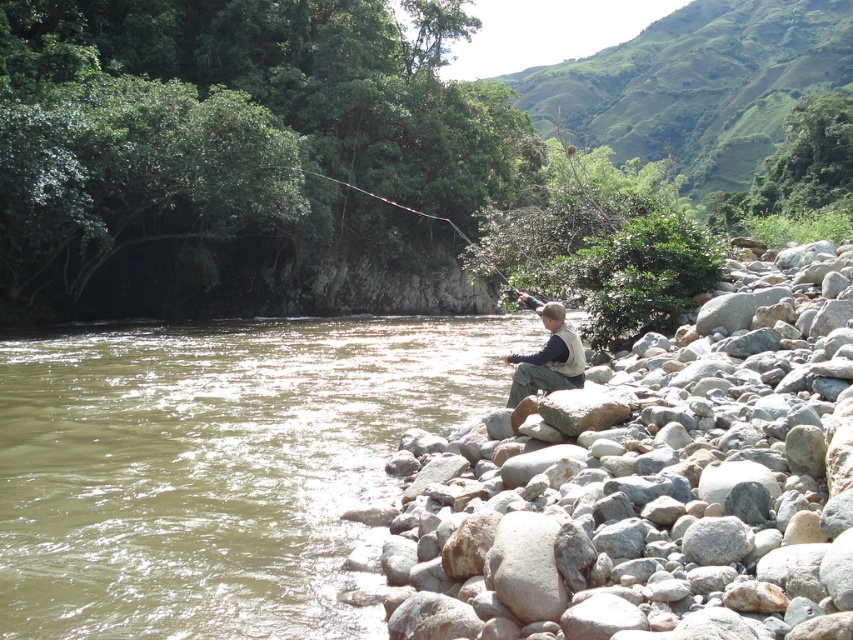
Is greenish water at lower left to the left of smooth brown fishing rod at upper center from the viewer's perspective?

No, greenish water at lower left is not to the left of smooth brown fishing rod at upper center.

Between greenish water at lower left and smooth brown fishing rod at upper center, which one has less height?

greenish water at lower left

Between point (172, 481) and point (492, 268), which one is positioned behind?

The point (492, 268) is behind.

The width and height of the screenshot is (853, 640). I want to click on greenish water at lower left, so (215, 467).

From the picture: Between gray smooth rock at right and greenish water at lower left, which one appears on the left side from the viewer's perspective?

greenish water at lower left

The height and width of the screenshot is (640, 853). What are the coordinates of `gray smooth rock at right` in the screenshot? It's located at (645, 493).

Can you confirm if gray smooth rock at right is bigger than smooth brown fishing rod at upper center?

No.

Between gray smooth rock at right and smooth brown fishing rod at upper center, which one has more height?

smooth brown fishing rod at upper center

Does point (680, 570) come farther from viewer compared to point (431, 216)?

No, it is not.

What are the coordinates of `gray smooth rock at right` in the screenshot? It's located at (645, 493).